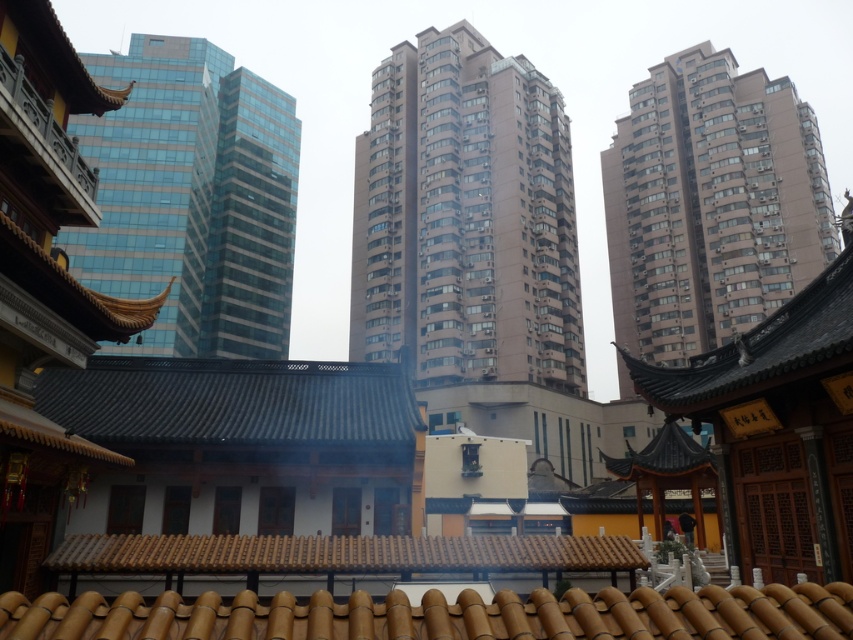
You are an architect analyzing the spatial arrangement of the buildings in the image. Which building, the beige concrete building at center or the blue glass building at left, is located closer to the ground level?

The beige concrete building at center is positioned under the blue glass building at left, meaning it is closer to the ground level.

You are an architect analyzing the spatial relationship between the blue glass building at left and the brown textured building at upper right in the image. Which building occupies a larger area in the scene?

The brown textured building at upper right is larger in size compared to the blue glass building at left, so it occupies a larger area in the scene.